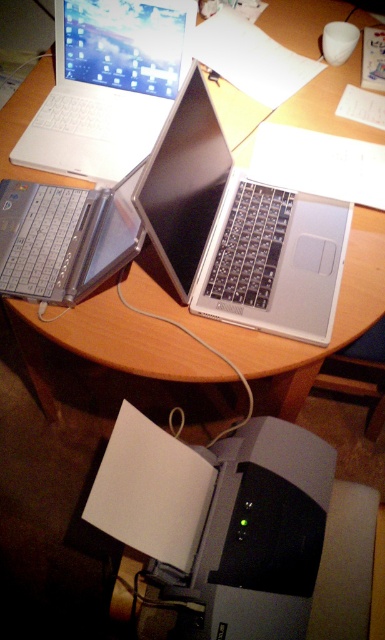
Question: Considering the real-world distances, which object is farthest from the gray matte printer at lower center?

Choices:
 (A) silver metallic laptop at left
 (B) satin silver laptop at center

Answer: (A)

Question: Does satin silver laptop at center have a smaller size compared to silver metallic laptop at left?

Choices:
 (A) no
 (B) yes

Answer: (A)

Question: Which point is farther to the camera?

Choices:
 (A) (220, 173)
 (B) (55, 115)
 (C) (117, 205)

Answer: (B)

Question: Which point is closer to the camera taking this photo?

Choices:
 (A) (152, 448)
 (B) (366, 253)
 (C) (41, 272)
 (D) (165, 44)

Answer: (A)

Question: Can you confirm if wooden round table at center is wider than silver metallic laptop at upper left?

Choices:
 (A) yes
 (B) no

Answer: (A)

Question: Is satin silver laptop at center thinner than silver metallic laptop at upper left?

Choices:
 (A) yes
 (B) no

Answer: (A)